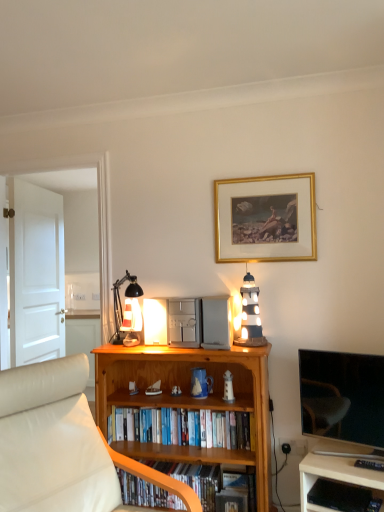
Where is `free space below flat screen tv at right (from a real-world perspective)`? The image size is (384, 512). free space below flat screen tv at right (from a real-world perspective) is located at coordinates (344, 450).